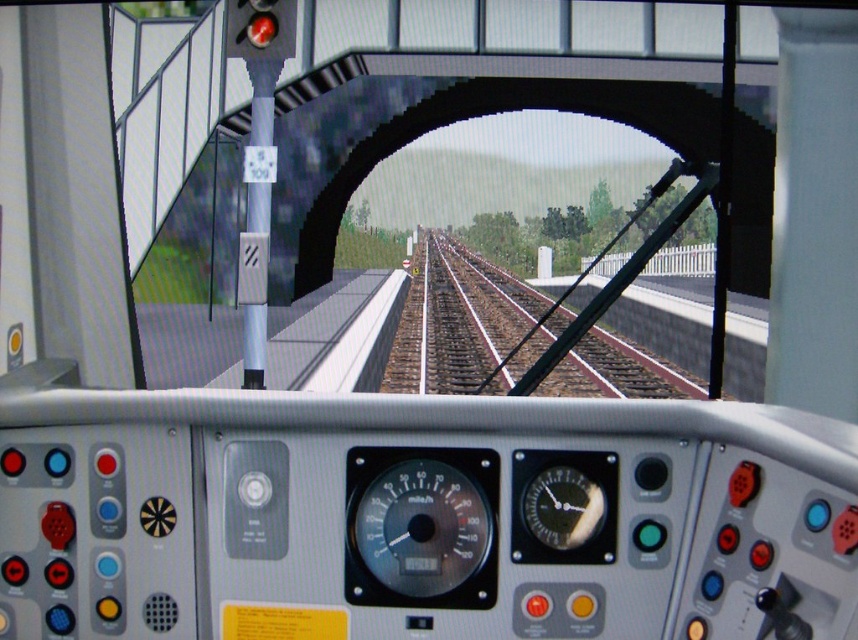
Between point (657, 372) and point (577, 477), which one is positioned in front?

Positioned in front is point (577, 477).

Which is above, brown gravel train track at center or black glass gauge at center?

brown gravel train track at center is above.

Who is more forward, (631, 353) or (571, 531)?

Positioned in front is point (571, 531).

At what (x,y) coordinates should I click in order to perform the action: click on brown gravel train track at center. Please return your answer as a coordinate pair (x, y). Image resolution: width=858 pixels, height=640 pixels. Looking at the image, I should click on (500, 312).

Can you confirm if matte black gauge at center is smaller than black glass gauge at center?

Actually, matte black gauge at center might be larger than black glass gauge at center.

Based on the photo, is matte black gauge at center taller than black glass gauge at center?

Correct, matte black gauge at center is much taller as black glass gauge at center.

Is point (445, 566) positioned before point (533, 492)?

Yes, it is.

Where is `matte black gauge at center`? This screenshot has width=858, height=640. matte black gauge at center is located at coordinates (420, 528).

I want to click on matte black gauge at center, so click(x=420, y=528).

Who is more forward, (x=382, y=602) or (x=603, y=394)?

Positioned in front is point (x=382, y=602).

Which is behind, point (408, 509) or point (563, 362)?

Point (563, 362)

The width and height of the screenshot is (858, 640). I want to click on matte black gauge at center, so click(420, 528).